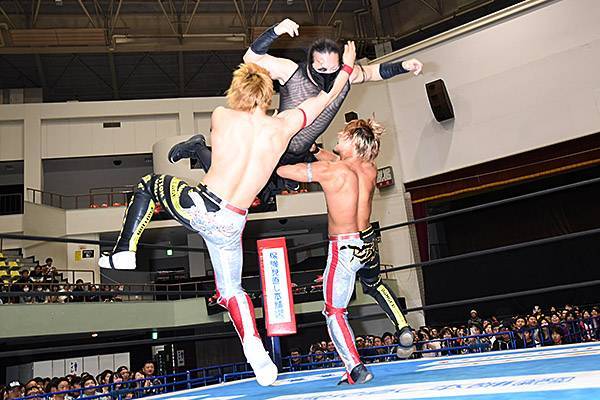
You are a GUI agent. You are given a task and a screenshot of the screen. Output one action in this format:
    pyautogui.click(x=<x>, y=<y>)
    Task: Click on the speaker
    The width and height of the screenshot is (600, 400).
    Given the screenshot: What is the action you would take?
    pyautogui.click(x=445, y=98)